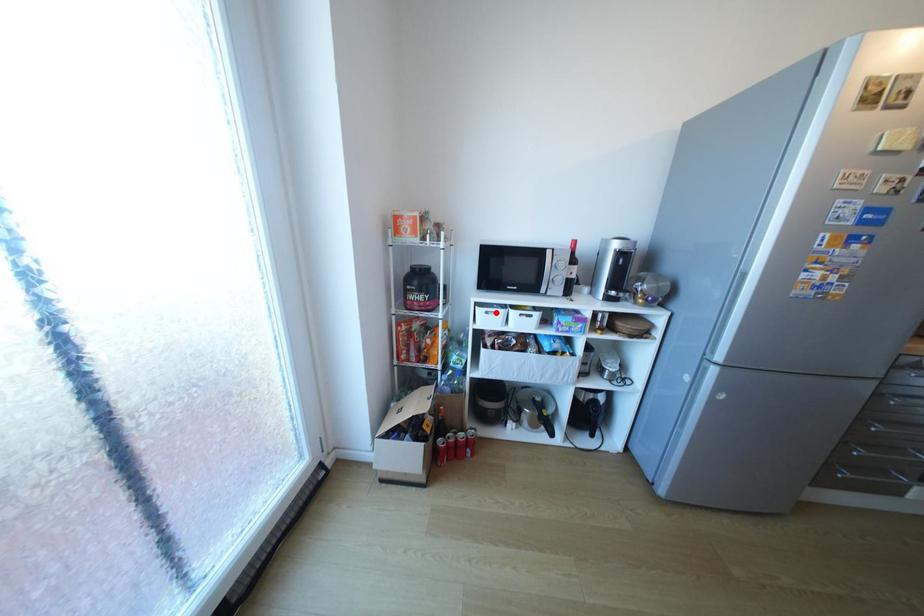
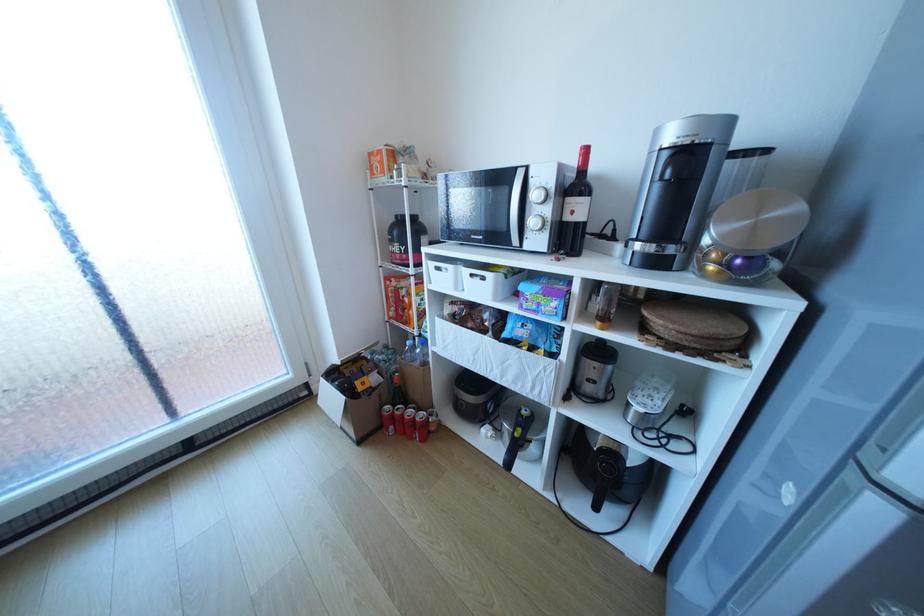
Where in the second image is the point corresponding to the highlighted location from the first image?

(446, 268)